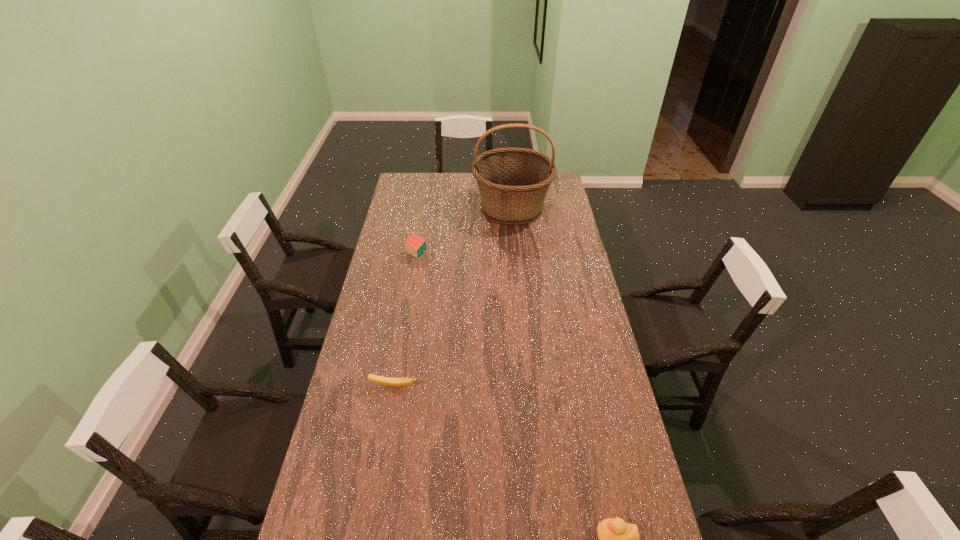
Locate an element on the screen. The image size is (960, 540). the tallest object is located at coordinates (513, 182).

At what (x,y) coordinates should I click in order to perform the action: click on basket. Please return your answer as a coordinate pair (x, y). The width and height of the screenshot is (960, 540). Looking at the image, I should click on (513, 182).

Find the location of a particular element. the third nearest object is located at coordinates (415, 245).

The height and width of the screenshot is (540, 960). What are the coordinates of `the third farthest object` in the screenshot? It's located at (381, 380).

I want to click on the shortest object, so click(381, 380).

Where is `vacant space located on the left of the tallest object`? The width and height of the screenshot is (960, 540). vacant space located on the left of the tallest object is located at coordinates (445, 208).

Locate an element on the screen. The height and width of the screenshot is (540, 960). vacant space located on the back of the cube is located at coordinates (425, 200).

Identify the location of vacant position located at the stem of the banana. (387, 429).

This screenshot has height=540, width=960. Identify the location of object at the far edge. (513, 182).

Identify the location of cube at the left edge. Image resolution: width=960 pixels, height=540 pixels. (415, 245).